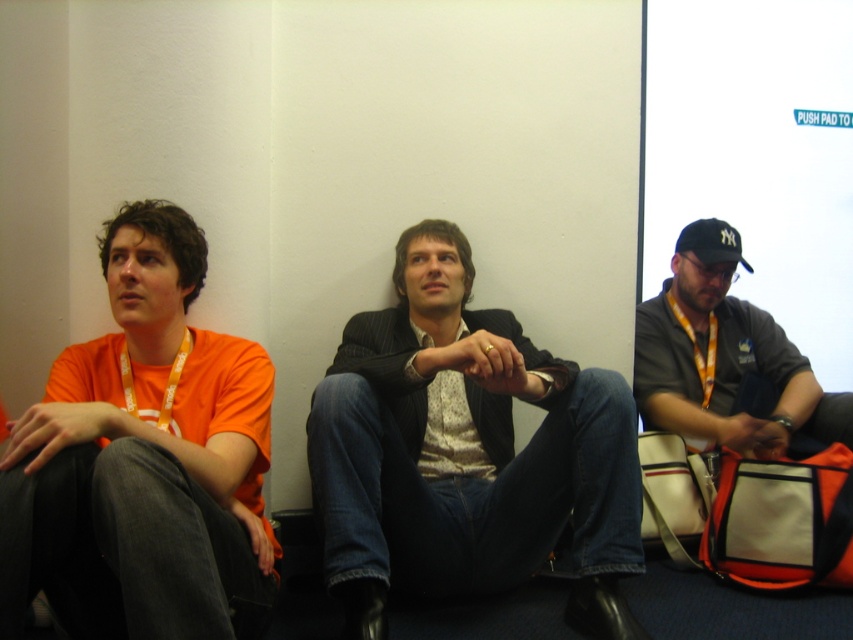
You are a photographer standing at the camera position. You want to adjust the focus so that the gray fabric shirt at center is in sharp focus. What distance should you set the focus to?

You should set the focus distance to 2.40 meters because the gray fabric shirt at center is 2.40 meters away from the camera.

You are organizing a photo shoot and need to ensure that all items are visible in the frame. Given that the gray fabric shirt at center and the black fabric baseball cap at right are part of the setup, which item requires more space in the frame to be fully captured?

The gray fabric shirt at center requires more space in the frame because it is larger in size than the black fabric baseball cap at right.